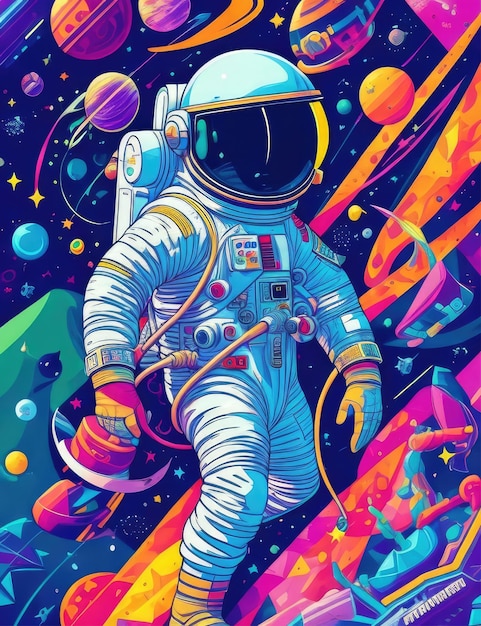
The width and height of the screenshot is (481, 626). I want to click on artwork, so click(277, 300).